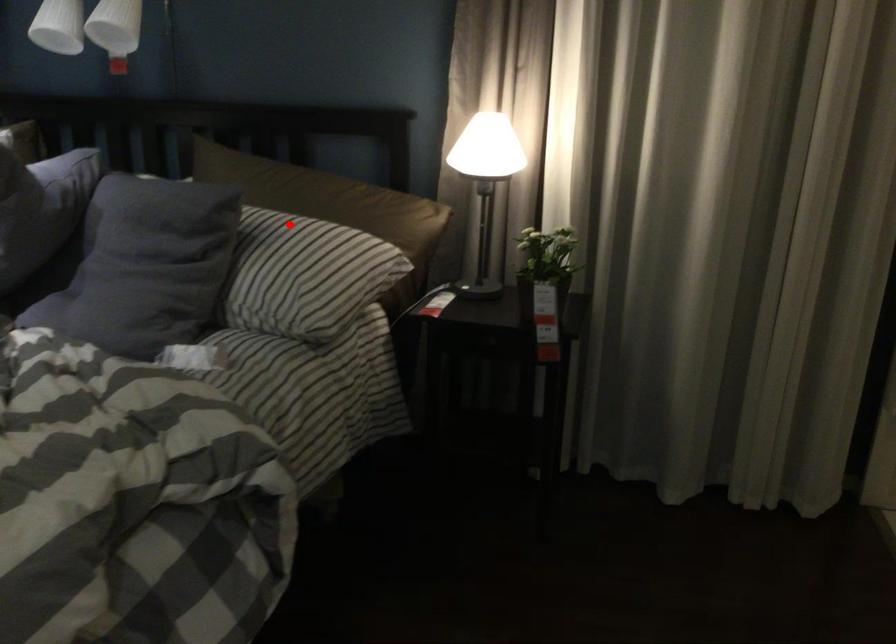
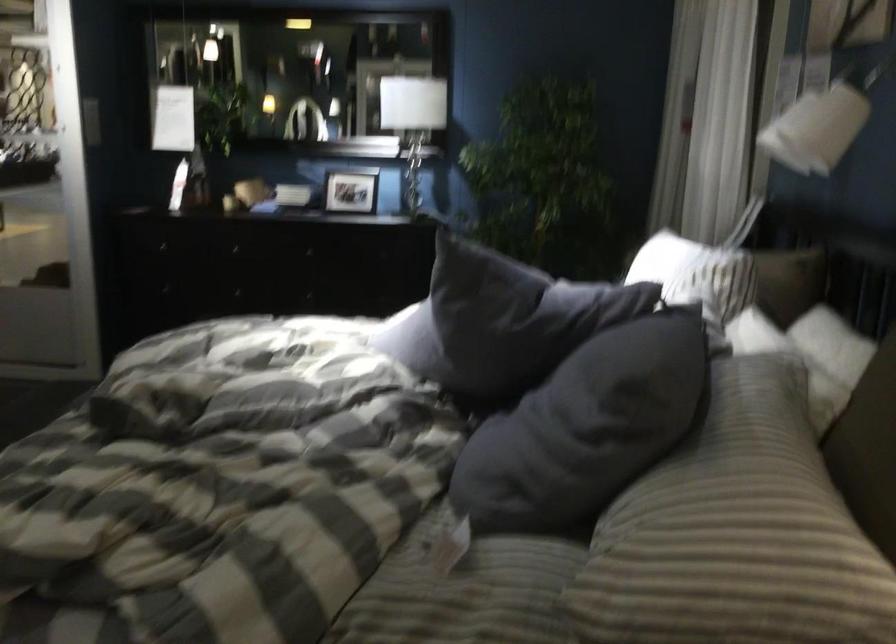
Question: I am providing you with two images of the same scene from different viewpoints. Image1 has a red point marked. In image2, the corresponding 3D location appears at what relative position? Reply with the corresponding letter.

Choices:
 (A) Closer
 (B) Farther

Answer: (A)